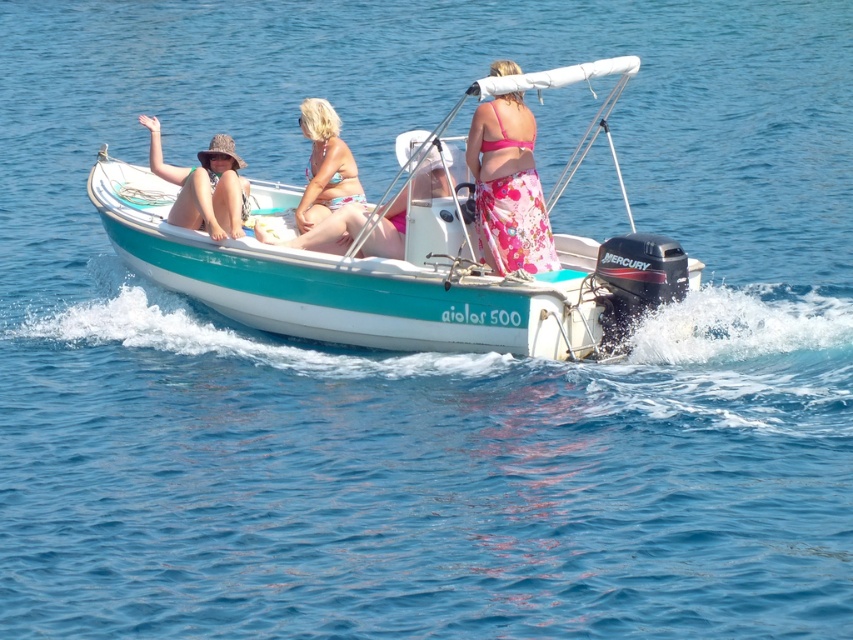
Is the position of pink floral skirt at center more distant than that of matte straw hat at left?

That is False.

Which is more to the left, pink floral skirt at center or matte straw hat at left?

From the viewer's perspective, matte straw hat at left appears more on the left side.

Which is in front, point (479, 116) or point (202, 172)?

Positioned in front is point (479, 116).

Find the location of a particular element. pink floral skirt at center is located at coordinates (508, 188).

Can you confirm if pink floral skirt at center is smaller than pink bikini at center?

Correct, pink floral skirt at center occupies less space than pink bikini at center.

Does pink floral skirt at center have a lesser width compared to pink bikini at center?

Yes, pink floral skirt at center is thinner than pink bikini at center.

Locate an element on the screen. pink floral skirt at center is located at coordinates (508, 188).

Find the location of a particular element. pink floral skirt at center is located at coordinates (508, 188).

Does teal glossy boat at center appear on the left side of matte straw hat at left?

No, teal glossy boat at center is not to the left of matte straw hat at left.

How distant is teal glossy boat at center from matte straw hat at left?

teal glossy boat at center is 5.54 meters away from matte straw hat at left.

Where is `teal glossy boat at center`? teal glossy boat at center is located at coordinates click(x=386, y=259).